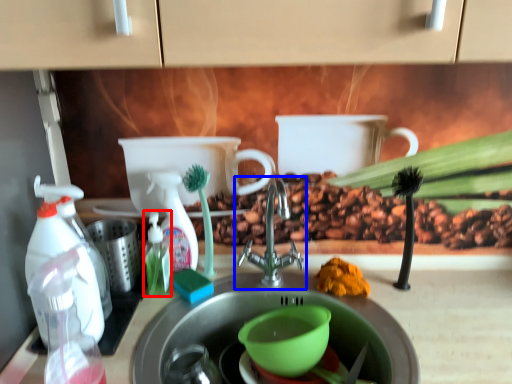
Question: Which object is further to the camera taking this photo, bottle (highlighted by a red box) or tap (highlighted by a blue box)?

Choices:
 (A) bottle
 (B) tap

Answer: (A)